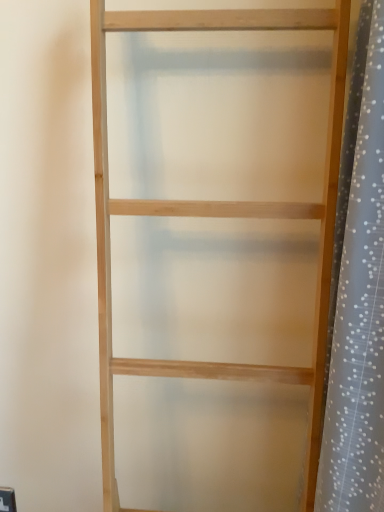
Find the location of a particular element. The image size is (384, 512). natural wood shelf at center is located at coordinates (214, 215).

Describe the element at coordinates (214, 215) in the screenshot. The image size is (384, 512). I see `natural wood shelf at center` at that location.

Where is `white dotted fabric at right`? The image size is (384, 512). white dotted fabric at right is located at coordinates (358, 296).

Describe the element at coordinates (358, 296) in the screenshot. I see `white dotted fabric at right` at that location.

What is the approximate width of white dotted fabric at right?

It is 7.62 inches.

Find the location of a particular element. The width and height of the screenshot is (384, 512). natural wood shelf at center is located at coordinates (214, 215).

In the image, is natural wood shelf at center on the left side or the right side of white dotted fabric at right?

Based on their positions, natural wood shelf at center is located to the left of white dotted fabric at right.

In the scene shown: Is natural wood shelf at center in front of or behind white dotted fabric at right in the image?

Visually, natural wood shelf at center is located in front of white dotted fabric at right.

Is point (106, 257) closer to viewer compared to point (377, 389)?

No, (106, 257) is further to viewer.

From the image's perspective, is natural wood shelf at center under white dotted fabric at right?

Indeed, from the image's perspective, natural wood shelf at center is shown beneath white dotted fabric at right.

From a real-world perspective, between natural wood shelf at center and white dotted fabric at right, who is vertically higher?

white dotted fabric at right, from a real-world perspective.

Between natural wood shelf at center and white dotted fabric at right, which one has larger width?

natural wood shelf at center is wider.

Considering the relative sizes of natural wood shelf at center and white dotted fabric at right in the image provided, is natural wood shelf at center taller than white dotted fabric at right?

Yes, natural wood shelf at center is taller than white dotted fabric at right.

Is natural wood shelf at center bigger or smaller than white dotted fabric at right?

natural wood shelf at center is bigger than white dotted fabric at right.

Can we say natural wood shelf at center lies outside white dotted fabric at right?

Absolutely, natural wood shelf at center is external to white dotted fabric at right.

Is natural wood shelf at center far away from white dotted fabric at right?

No, natural wood shelf at center is not far from white dotted fabric at right.

Is natural wood shelf at center turned away from white dotted fabric at right?

No, natural wood shelf at center is not facing the opposite direction of white dotted fabric at right.

What's the angular difference between natural wood shelf at center and white dotted fabric at right's facing directions?

The angle between the facing direction of natural wood shelf at center and the facing direction of white dotted fabric at right is 88 degrees.

Identify the location of shower curtain that appears above the natural wood shelf at center (from a real-world perspective). The image size is (384, 512). (358, 296).

Which is more to the left, white dotted fabric at right or natural wood shelf at center?

From the viewer's perspective, natural wood shelf at center appears more on the left side.

Relative to natural wood shelf at center, is white dotted fabric at right in front or behind?

Clearly, white dotted fabric at right is behind natural wood shelf at center.

Does point (344, 195) appear closer or farther from the camera than point (92, 70)?

Point (344, 195).

From the image's perspective, which object appears higher, white dotted fabric at right or natural wood shelf at center?

white dotted fabric at right, from the image's perspective.

From a real-world perspective, is white dotted fabric at right above or below natural wood shelf at center?

white dotted fabric at right is above natural wood shelf at center.

Between white dotted fabric at right and natural wood shelf at center, which one has smaller width?

Thinner between the two is white dotted fabric at right.

Is white dotted fabric at right taller or shorter than natural wood shelf at center?

In the image, white dotted fabric at right appears to be shorter than natural wood shelf at center.

Which of these two, white dotted fabric at right or natural wood shelf at center, is bigger?

natural wood shelf at center is bigger.

Is natural wood shelf at center a part of white dotted fabric at right?

No, natural wood shelf at center is not a part of white dotted fabric at right.

Is white dotted fabric at right next to natural wood shelf at center?

No, white dotted fabric at right is not making contact with natural wood shelf at center.

Is white dotted fabric at right positioned with its back to natural wood shelf at center?

That's right, white dotted fabric at right is facing away from natural wood shelf at center.

How many degrees apart are the facing directions of white dotted fabric at right and natural wood shelf at center?

88 degrees separate the facing orientations of white dotted fabric at right and natural wood shelf at center.

There is a natural wood shelf at center. Identify the location of shower curtain above it (from a real-world perspective). (358, 296).

Where is `shelf on the left of white dotted fabric at right`? This screenshot has height=512, width=384. shelf on the left of white dotted fabric at right is located at coordinates (214, 215).

This screenshot has width=384, height=512. Identify the location of shelf below the white dotted fabric at right (from the image's perspective). [214, 215].